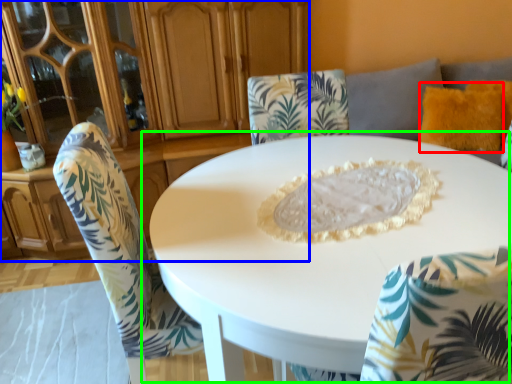
Question: Which is farther away from pillow (highlighted by a red box)? dresser (highlighted by a blue box) or table (highlighted by a green box)?

Choices:
 (A) dresser
 (B) table

Answer: (A)